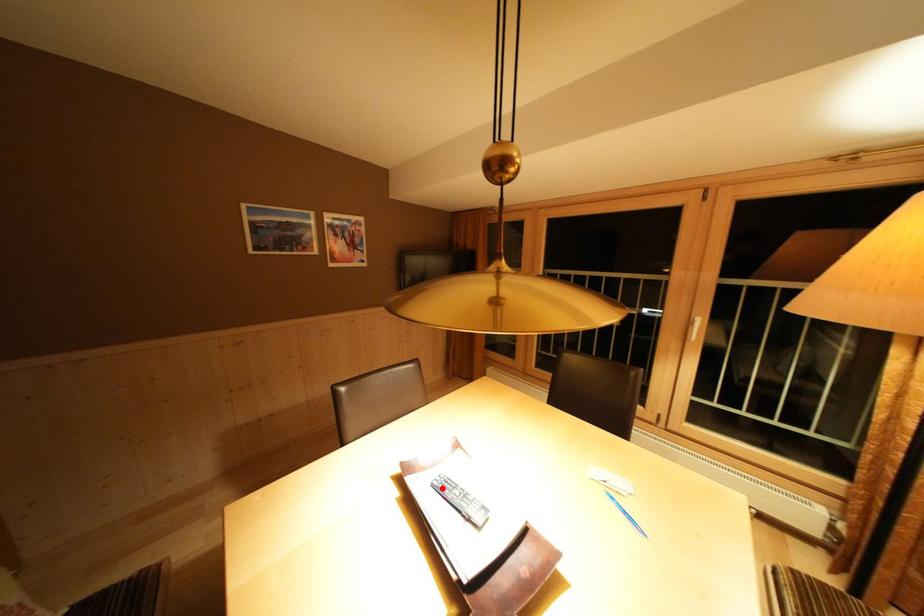
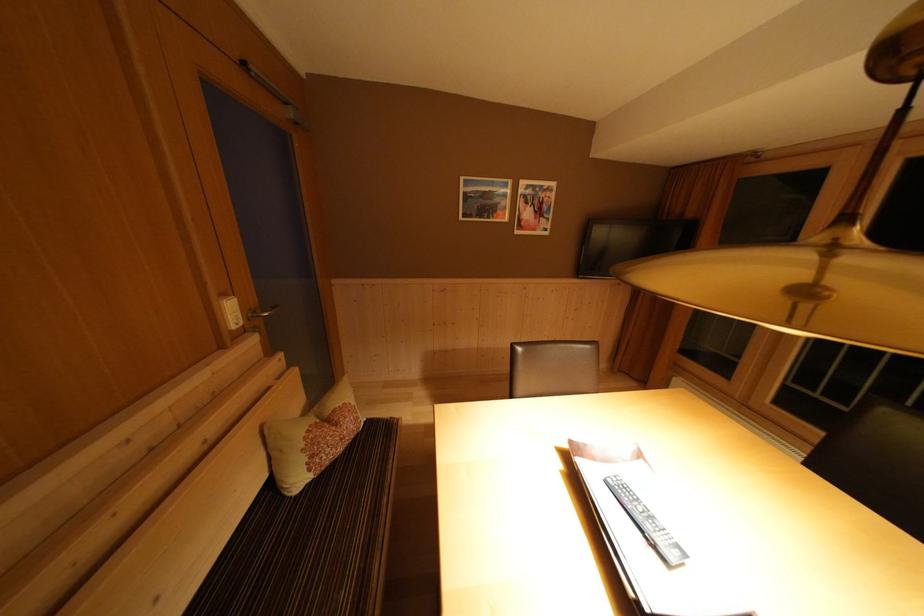
Locate, in the second image, the point that corresponds to the highlighted location in the first image.

(617, 485)